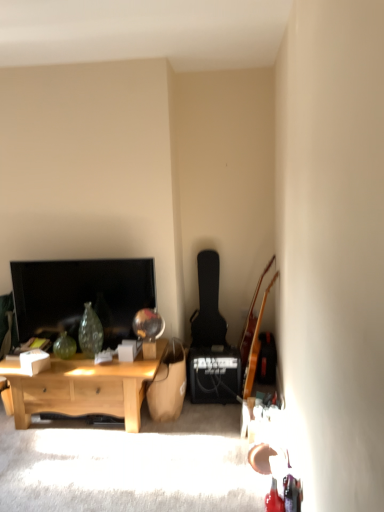
Question: From a real-world perspective, is light wood desk at lower left positioned above or below wooden acoustic guitar at right, the 1th guitar positioned from the front?

Choices:
 (A) above
 (B) below

Answer: (B)

Question: In the image, is light wood desk at lower left positioned in front of or behind wooden acoustic guitar at right, the 1th guitar positioned from the front?

Choices:
 (A) front
 (B) behind

Answer: (A)

Question: Which object is positioned farthest from the matte black tv at left?

Choices:
 (A) light wood desk at lower left
 (B) wooden acoustic guitar at right, the 1th guitar positioned from the front
 (C) black matte guitar at center-right, which is the second guitar from front to back
 (D) black matte speaker at lower right

Answer: (B)

Question: Estimate the real-world distances between objects in this image. Which object is farther from the wooden acoustic guitar at right, the 1th guitar when ordered from right to left?

Choices:
 (A) black matte guitar at center-right, which is the first guitar in back-to-front order
 (B) light wood desk at lower left
 (C) black matte speaker at lower right
 (D) matte black tv at left

Answer: (D)